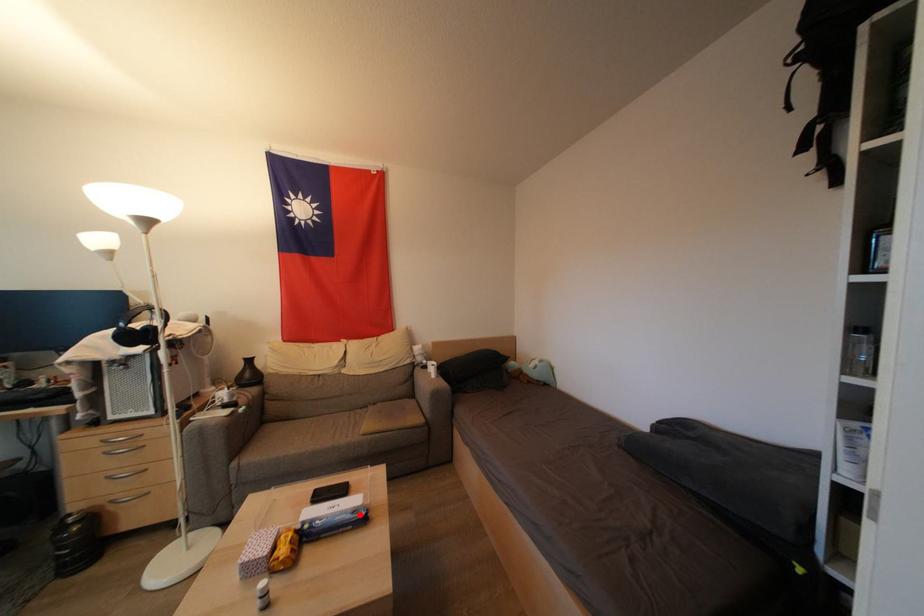
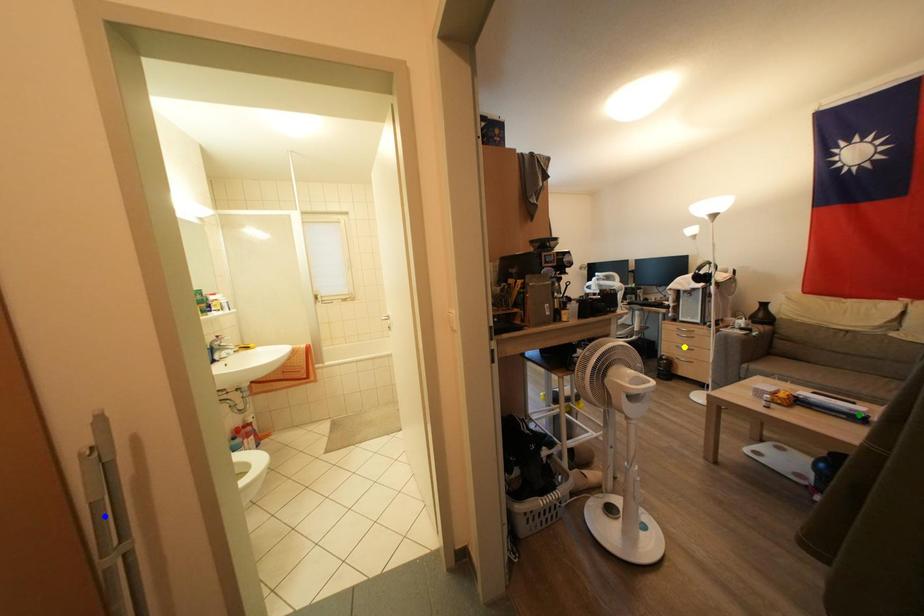
Question: I am providing you with two images of the same scene from different viewpoints. A red point is marked on the first image. You are given multiple points on the second image. In image 2, which mark is for the same physical point as the one in image 1?

Choices:
 (A) green point
 (B) yellow point
 (C) blue point

Answer: (A)